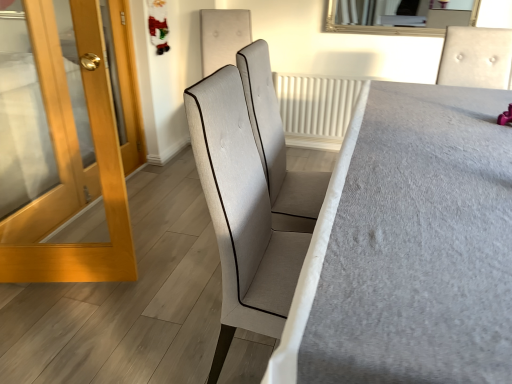
Question: Does point (331, 4) appear closer or farther from the camera than point (280, 173)?

Choices:
 (A) closer
 (B) farther

Answer: (B)

Question: Looking at their shapes, would you say silver-framed mirror at upper center is wider or thinner than light gray fabric chair at center, which is the second chair from right to left?

Choices:
 (A) wide
 (B) thin

Answer: (B)

Question: Which object is the farthest from the light gray fabric chair at upper right, placed as the 1th chair when sorted from right to left?

Choices:
 (A) light gray fabric chair at center, the first chair positioned from the left
 (B) textured fabric chair at center
 (C) wooden glossy door at left
 (D) silver-framed mirror at upper center

Answer: (C)

Question: Estimate the real-world distances between objects in this image. Which object is farther from the light gray fabric chair at center, the first chair positioned from the left?

Choices:
 (A) textured fabric chair at center
 (B) silver-framed mirror at upper center
 (C) light gray fabric chair at upper right, which is the 2th chair from left to right
 (D) wooden glossy door at left

Answer: (B)